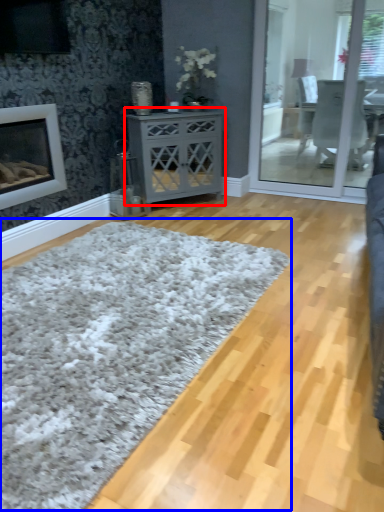
Question: Which object is further to the camera taking this photo, nightstand (highlighted by a red box) or plain (highlighted by a blue box)?

Choices:
 (A) nightstand
 (B) plain

Answer: (A)